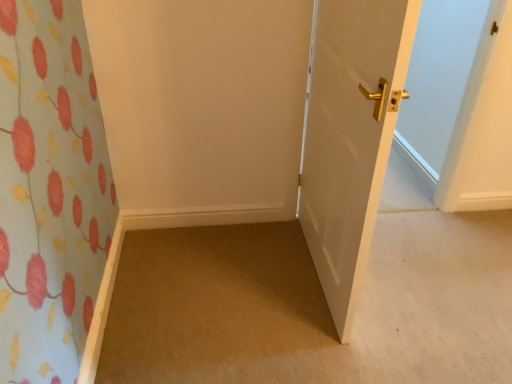
Where is `carpet at lower left`? carpet at lower left is located at coordinates (313, 306).

Describe the element at coordinates (313, 306) in the screenshot. I see `carpet at lower left` at that location.

What is the approximate width of white glossy door at right?

It is 5.78 inches.

Where is `white glossy door at right`? The height and width of the screenshot is (384, 512). white glossy door at right is located at coordinates (351, 137).

In order to face white glossy door at right, should I rotate leftwards or rightwards?

Turn right by 10.211 degrees to look at white glossy door at right.

What do you see at coordinates (351, 137) in the screenshot? I see `white glossy door at right` at bounding box center [351, 137].

Locate an element on the screen. The image size is (512, 384). carpet at lower left is located at coordinates (313, 306).

Is white glossy door at right to the left or to the right of carpet at lower left in the image?

From the image, it's evident that white glossy door at right is to the left of carpet at lower left.

Is white glossy door at right closer to camera compared to carpet at lower left?

That is True.

Is point (373, 18) closer to camera compared to point (327, 363)?

Yes, it is in front of point (327, 363).

From the image's perspective, which one is positioned lower, white glossy door at right or carpet at lower left?

carpet at lower left appears lower in the image.

From a real-world perspective, between white glossy door at right and carpet at lower left, who is vertically higher?

From a 3D spatial view, white glossy door at right is above.

Is white glossy door at right thinner than carpet at lower left?

Indeed, white glossy door at right has a lesser width compared to carpet at lower left.

In terms of height, does white glossy door at right look taller or shorter compared to carpet at lower left?

In the image, white glossy door at right appears to be taller than carpet at lower left.

Is white glossy door at right bigger or smaller than carpet at lower left?

In the image, white glossy door at right appears to be larger than carpet at lower left.

Is white glossy door at right situated inside carpet at lower left or outside?

white glossy door at right exists outside the volume of carpet at lower left.

Is white glossy door at right touching carpet at lower left?

No, white glossy door at right is not with carpet at lower left.

Is white glossy door at right looking in the opposite direction of carpet at lower left?

No, white glossy door at right is not facing away from carpet at lower left.

What's the angular difference between white glossy door at right and carpet at lower left's facing directions?

90.8 degrees separate the facing orientations of white glossy door at right and carpet at lower left.

In order to click on plain located below the white glossy door at right (from the image's perspective) in this screenshot , I will do `click(313, 306)`.

From the picture: Would you say carpet at lower left is to the left or to the right of white glossy door at right in the picture?

Clearly, carpet at lower left is on the right of white glossy door at right in the image.

Which is in front, carpet at lower left or white glossy door at right?

white glossy door at right is more forward.

Which is closer to the camera, (465, 231) or (346, 58)?

The point (346, 58) is closer to the camera.

From the image's perspective, which one is positioned higher, carpet at lower left or white glossy door at right?

white glossy door at right is shown above in the image.

From a real-world perspective, is carpet at lower left above or below white glossy door at right?

carpet at lower left is below white glossy door at right.

Which object is wider, carpet at lower left or white glossy door at right?

carpet at lower left is wider.

Does carpet at lower left have a greater height compared to white glossy door at right?

No.

Who is bigger, carpet at lower left or white glossy door at right?

Bigger between the two is white glossy door at right.

Is white glossy door at right inside carpet at lower left?

No.

Is carpet at lower left not near white glossy door at right?

No.

Is carpet at lower left aimed at white glossy door at right?

No, carpet at lower left is not facing towards white glossy door at right.

How much distance is there between carpet at lower left and white glossy door at right?

carpet at lower left and white glossy door at right are 21.91 inches apart.

The image size is (512, 384). I want to click on door in front of the carpet at lower left, so click(351, 137).

Where is `plain lying behind the white glossy door at right`? plain lying behind the white glossy door at right is located at coordinates (313, 306).

This screenshot has width=512, height=384. Identify the location of plain below the white glossy door at right (from a real-world perspective). (313, 306).